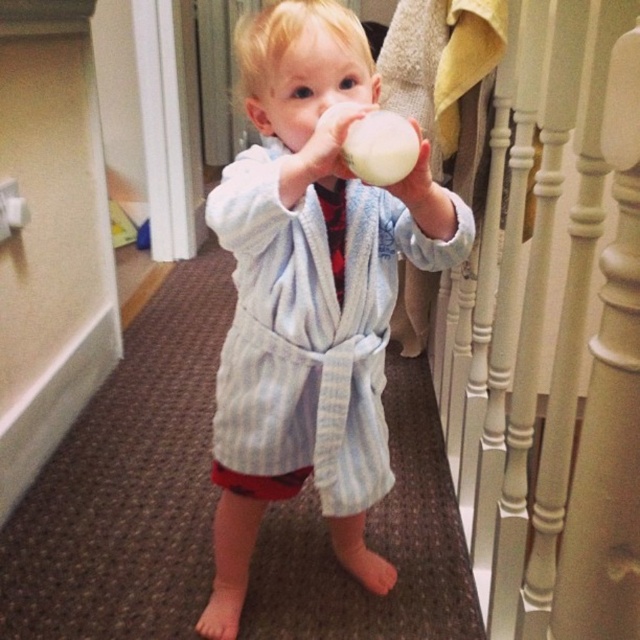
Can you confirm if white painted wood at right is bigger than light blue striped robe at center?

Actually, white painted wood at right might be smaller than light blue striped robe at center.

Is point (490, 609) closer to camera compared to point (321, 483)?

No.

Between point (536, 80) and point (243, 60), which one is positioned in front?

Point (243, 60) is in front.

This screenshot has width=640, height=640. In order to click on white painted wood at right in this screenshot , I will do `click(545, 301)`.